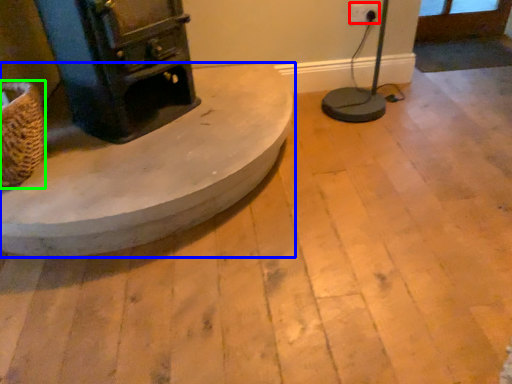
Question: Which is farther away from electric outlet (highlighted by a red box)? furniture (highlighted by a blue box) or basket (highlighted by a green box)?

Choices:
 (A) furniture
 (B) basket

Answer: (B)